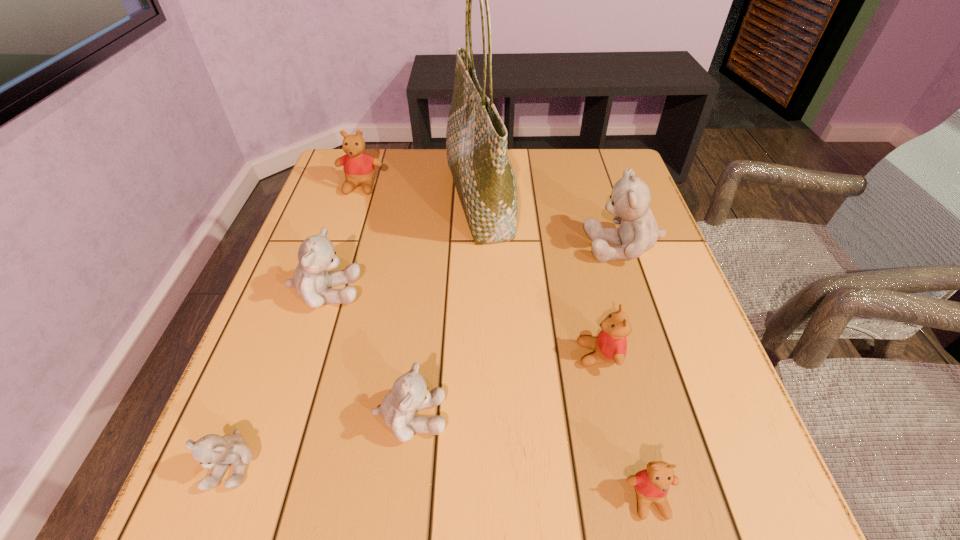
This screenshot has width=960, height=540. I want to click on vacant space located 0.120m on the front-facing side of the second biggest red teddy bear, so click(x=513, y=355).

Where is `free location located on the front-facing side of the second biggest red teddy bear`? This screenshot has width=960, height=540. free location located on the front-facing side of the second biggest red teddy bear is located at coordinates (410, 355).

Where is `vacant area situated 0.160m on the front-facing side of the second biggest red teddy bear`? Image resolution: width=960 pixels, height=540 pixels. vacant area situated 0.160m on the front-facing side of the second biggest red teddy bear is located at coordinates (491, 355).

Where is `free region located on the face of the fourth teddy bear from left to right`? free region located on the face of the fourth teddy bear from left to right is located at coordinates (501, 417).

Find the location of a particular element. The height and width of the screenshot is (540, 960). shopping bag that is at the far edge is located at coordinates (476, 138).

At what (x,y) coordinates should I click in order to perform the action: click on teddy bear situated at the far edge. Please return your answer as a coordinate pair (x, y). Looking at the image, I should click on pos(358,166).

Where is `object present at the far left corner`? The height and width of the screenshot is (540, 960). object present at the far left corner is located at coordinates (358, 166).

Where is `object that is at the near left corner`? The image size is (960, 540). object that is at the near left corner is located at coordinates (213, 451).

I want to click on object located in the near right corner section of the desktop, so click(652, 484).

In the image, there is a desktop. Where is `vacant space at the far edge`? Image resolution: width=960 pixels, height=540 pixels. vacant space at the far edge is located at coordinates (444, 188).